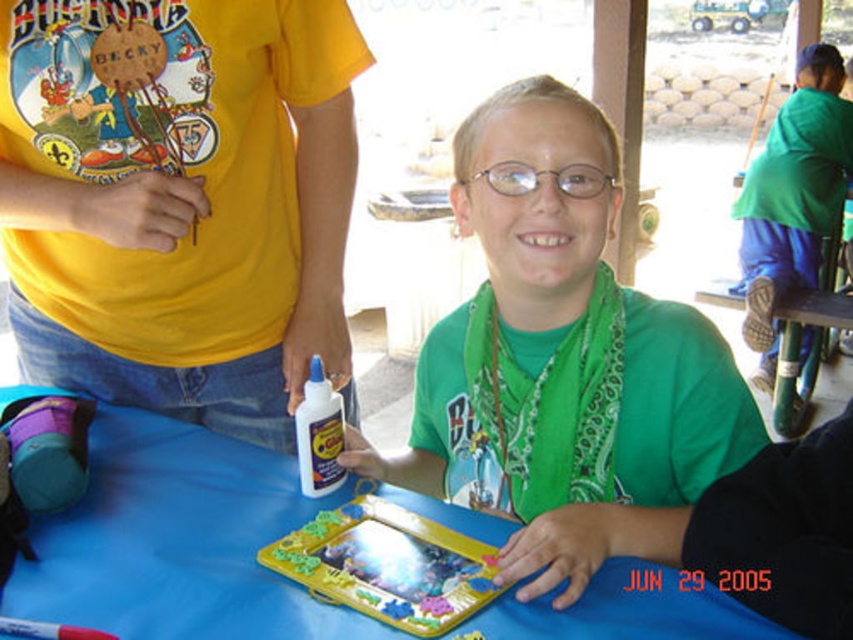
Is green matte shirt at center bigger than yellow plastic board game at center?

Yes, green matte shirt at center is bigger than yellow plastic board game at center.

Does green matte shirt at center come behind yellow plastic board game at center?

Yes, it is.

Is point (456, 353) in front of point (486, 596)?

No, (456, 353) is behind (486, 596).

What are the coordinates of `green matte shirt at center` in the screenshot? It's located at (564, 365).

Does point (601, 285) come in front of point (752, 241)?

Yes.

Between point (675, 451) and point (747, 304), which one is positioned behind?

Point (747, 304)

Locate an element on the screen. green matte shirt at center is located at coordinates 564,365.

Locate an element on the screen. The height and width of the screenshot is (640, 853). yellow plastic board game at center is located at coordinates (387, 564).

Is yellow plastic board game at center bigger than clear plastic glasses at center?

Yes, yellow plastic board game at center is bigger than clear plastic glasses at center.

This screenshot has height=640, width=853. In order to click on yellow plastic board game at center in this screenshot , I will do `click(387, 564)`.

What are the coordinates of `yellow plastic board game at center` in the screenshot? It's located at (387, 564).